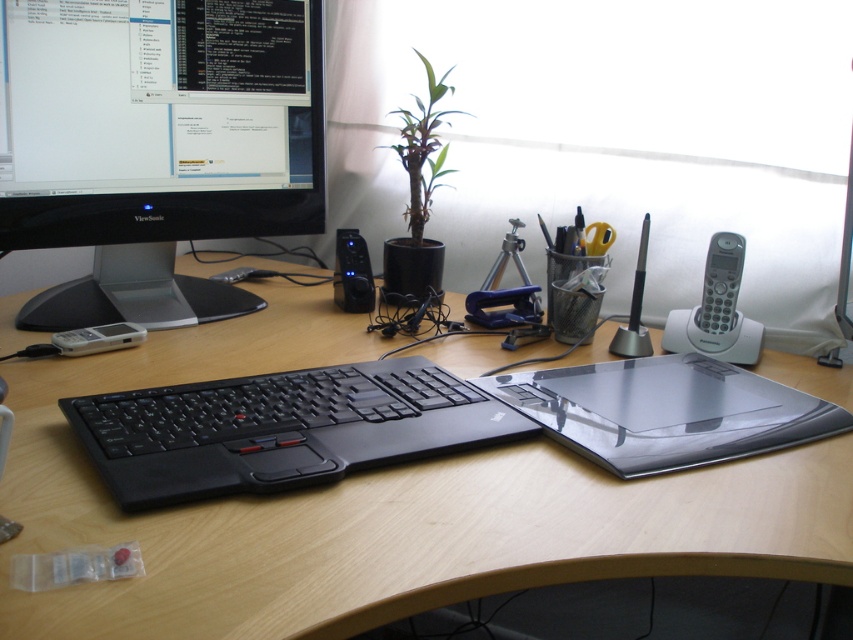
You are standing in front of the desk and want to reach the point marked at coordinates (323, 300). Considering your arm can extend 3.5 feet, can you comfortably reach that point without moving your body?

The point at coordinates (323, 300) is 4.00 feet away from the viewer. Since your arm can only extend 3.5 feet, you cannot comfortably reach that point without moving your body.

You are setting up a new speaker and want to place it to the left of the light brown wood computer desk at center. Is there space available where the black plastic speaker at center is currently located?

The black plastic speaker at center is currently located to the left of the light brown wood computer desk at center. Since you want to place the new speaker to the left of the desk, the current position of the black plastic speaker at center is a suitable location.